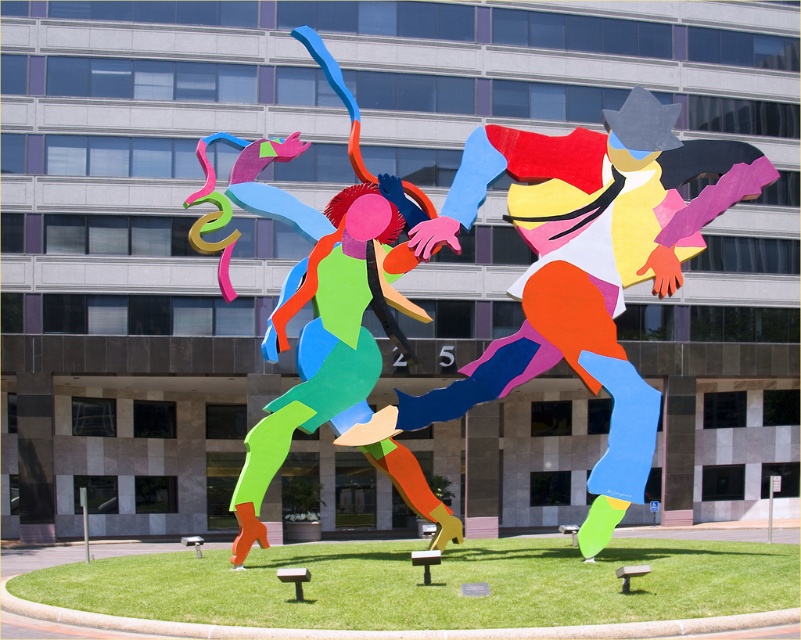
Does matte plastic figure at right have a smaller size compared to matte plastic sculpture at center?

No, matte plastic figure at right is not smaller than matte plastic sculpture at center.

Is matte plastic figure at right above matte plastic sculpture at center?

Incorrect, matte plastic figure at right is not positioned above matte plastic sculpture at center.

Find the location of `matte plastic figure at right`. matte plastic figure at right is located at coordinates point(590,268).